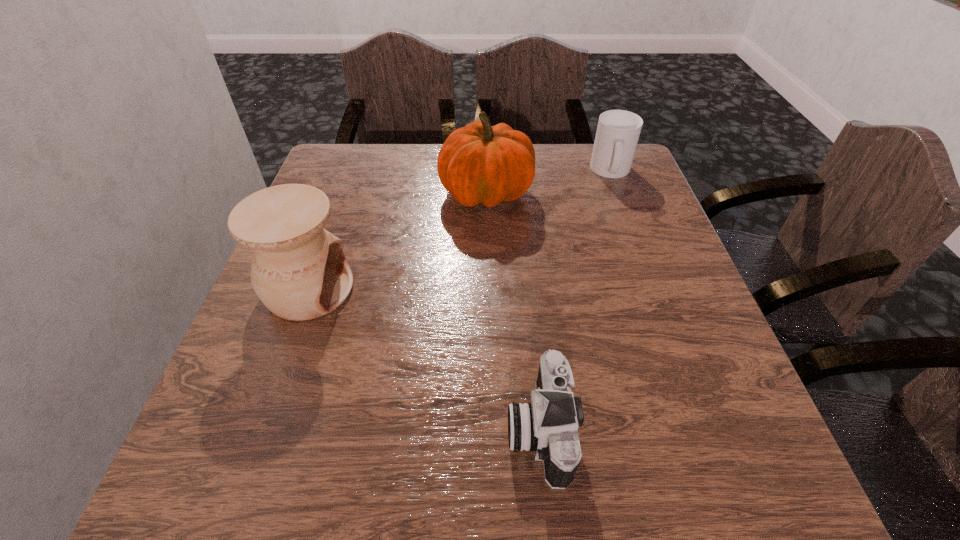
The width and height of the screenshot is (960, 540). Find the location of `free space at the far left corner of the desktop`. free space at the far left corner of the desktop is located at coordinates (348, 158).

This screenshot has height=540, width=960. Find the location of `vacant space at the near left corner`. vacant space at the near left corner is located at coordinates (187, 472).

Find the location of a particular element. Image resolution: width=960 pixels, height=540 pixels. vacant space at the near right corner of the desktop is located at coordinates (720, 459).

The image size is (960, 540). Identify the location of empty location between the mug and the pumpkin. (549, 182).

Where is `vacant area that lies between the pumpkin and the rightmost object`? vacant area that lies between the pumpkin and the rightmost object is located at coordinates (549, 182).

The height and width of the screenshot is (540, 960). In order to click on vacant area that lies between the third tallest object and the leftmost object in this screenshot , I will do `click(460, 230)`.

This screenshot has height=540, width=960. In order to click on free space that is in between the pumpkin and the leftmost object in this screenshot , I will do `click(397, 241)`.

The image size is (960, 540). I want to click on vacant region between the pumpkin and the nearest object, so point(513,310).

Locate an element on the screen. free point between the mug and the pumpkin is located at coordinates (549, 182).

This screenshot has width=960, height=540. I want to click on free space between the pottery and the shortest object, so click(424, 359).